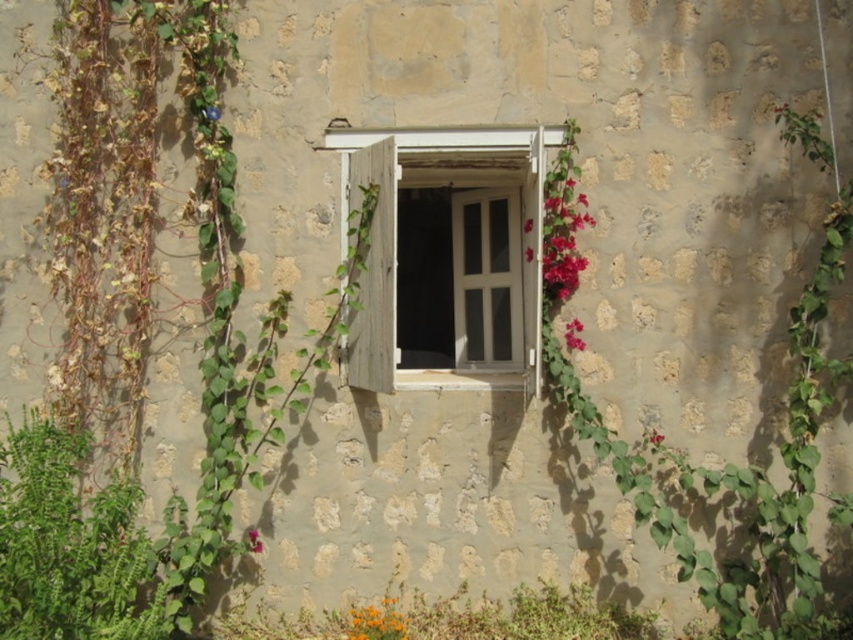
Question: Does pink matte flowers at upper right come in front of pink matte flower at lower center?

Choices:
 (A) no
 (B) yes

Answer: (A)

Question: Which point is closer to the camera?

Choices:
 (A) pink matte flowers at upper right
 (B) green leafy vine at right
 (C) orange matte flower at lower center

Answer: (B)

Question: Considering the real-world distances, which object is closest to the white wooden window at center?

Choices:
 (A) pink matte flower at lower center
 (B) pink matte flower at right
 (C) orange matte flower at lower center
 (D) green leafy vine at right

Answer: (B)

Question: Does orange matte flower at lower center have a lesser width compared to pink matte flower at right?

Choices:
 (A) yes
 (B) no

Answer: (B)

Question: Estimate the real-world distances between objects in this image. Which object is farther from the pink matte flower at lower center?

Choices:
 (A) orange matte flower at lower center
 (B) pink matte flower at right
 (C) green leafy vine at right
 (D) pink matte flowers at upper right

Answer: (C)

Question: Can you confirm if green leafy vine at right is bigger than pink matte flowers at upper right?

Choices:
 (A) no
 (B) yes

Answer: (B)